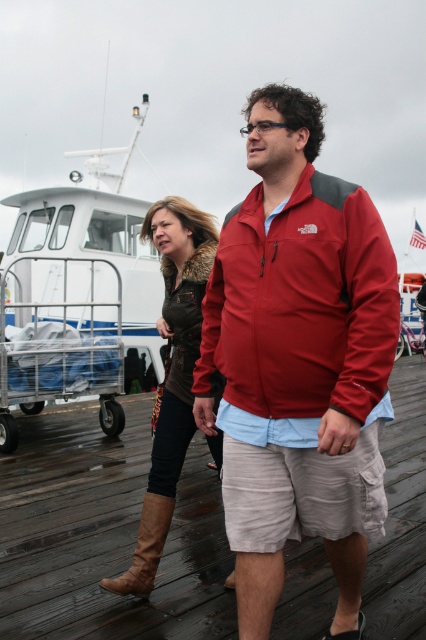
Is point (368, 371) positioned behind point (100, 586)?

That is False.

Is point (239, 378) closer to viewer compared to point (169, 397)?

Yes, point (239, 378) is closer to viewer.

What are the coordinates of `matte red jacket at center` in the screenshot? It's located at 302,305.

Can you confirm if brown leather boots at lower left is bigger than matte red jacket at center?

Incorrect, brown leather boots at lower left is not larger than matte red jacket at center.

Identify the location of brown leather boots at lower left. This screenshot has height=640, width=426. (106, 532).

Does point (31, 554) come farther from viewer compared to point (215, 252)?

Yes, it is behind point (215, 252).

This screenshot has height=640, width=426. In order to click on brown leather boots at lower left in this screenshot , I will do `click(106, 532)`.

Does point (311, 548) come in front of point (221, 410)?

That is False.

Is brown leather boots at lower left wider than light beige cotton shorts at center?

Indeed, brown leather boots at lower left has a greater width compared to light beige cotton shorts at center.

The image size is (426, 640). Describe the element at coordinates (106, 532) in the screenshot. I see `brown leather boots at lower left` at that location.

Where is `brown leather boots at lower left`? The image size is (426, 640). brown leather boots at lower left is located at coordinates (106, 532).